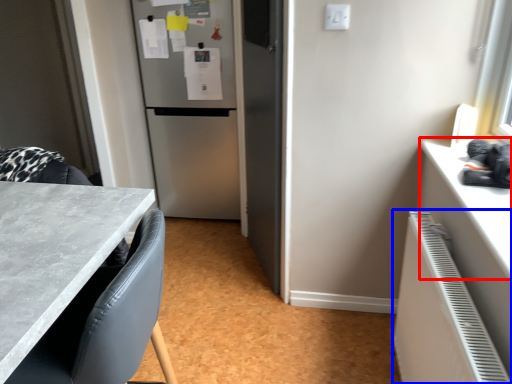
Question: Which of the following is the farthest to the observer, counter top (highlighted by a red box) or radiator (highlighted by a blue box)?

Choices:
 (A) counter top
 (B) radiator

Answer: (A)